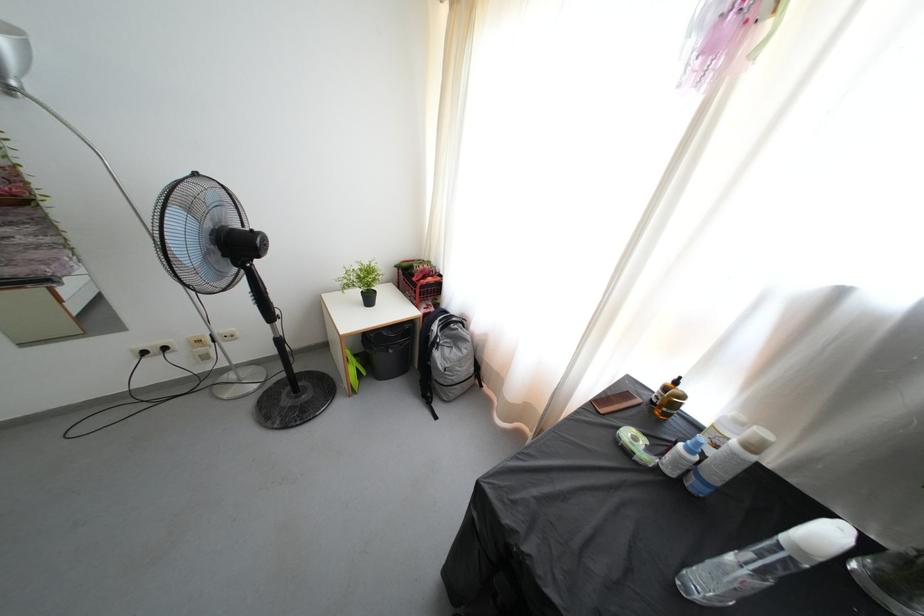
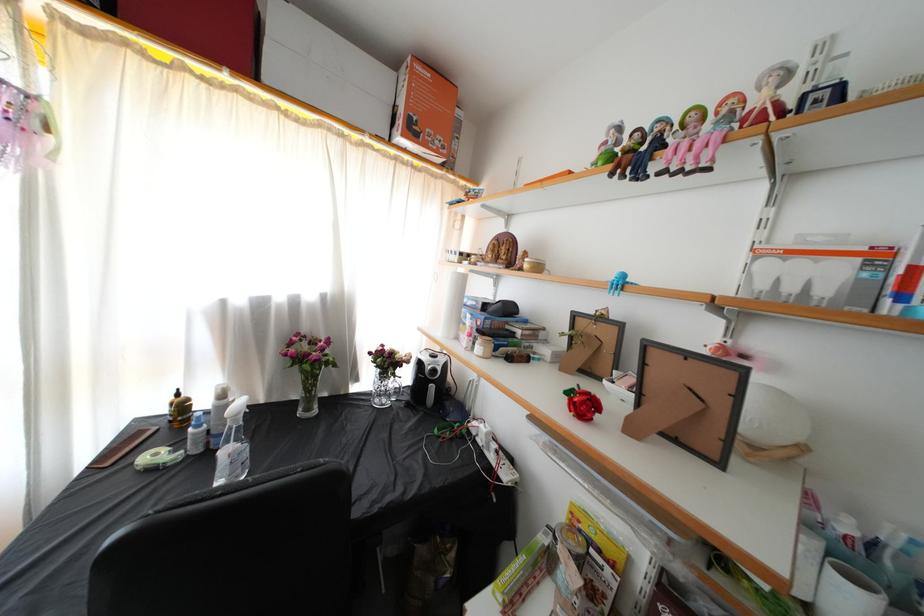
Find the pixel in the second image that matches (x=633, y=400) in the first image.

(144, 439)